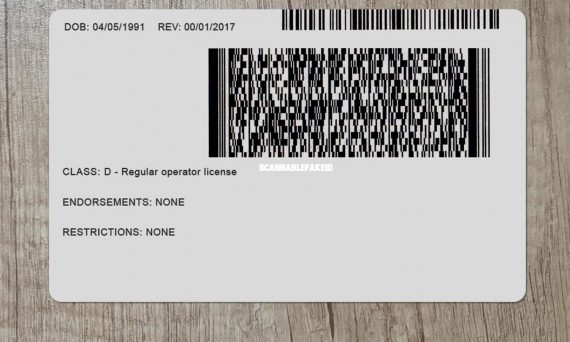
What are the coordinates of `table` in the screenshot? It's located at (362, 326).